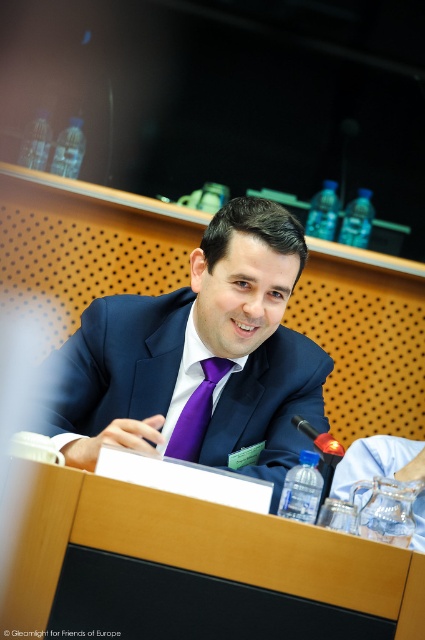
You are organizing a conference and need to place a name tag holder on the table. The name tag holder requires a clear line of sight to the front of the purple satin tie at center. Is the clear glass water at lower right blocking this line of sight?

The clear glass water at lower right is in front of the purple satin tie at center, so it is blocking the line of sight to the front of the purple satin tie at center.

You are organizing a conference and need to place a name tag holder on the table. The holder requires a space that is above both the clear glass water at lower right and the purple satin tie at center. Is there a suitable spot available on the table?

The clear glass water at lower right is located below the purple satin tie at center, so the area above the purple satin tie at center would be above both objects. Therefore, placing the name tag holder there would satisfy the requirement.